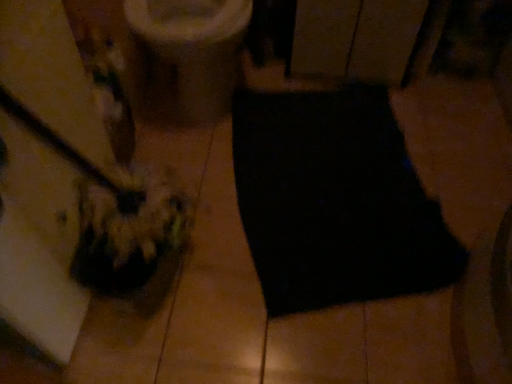
What do you see at coordinates (186, 56) in the screenshot? The width and height of the screenshot is (512, 384). I see `white glossy toilet at upper center` at bounding box center [186, 56].

Locate an element on the screen. The height and width of the screenshot is (384, 512). white glossy toilet at upper center is located at coordinates (186, 56).

In order to click on white glossy toilet at upper center in this screenshot , I will do `click(186, 56)`.